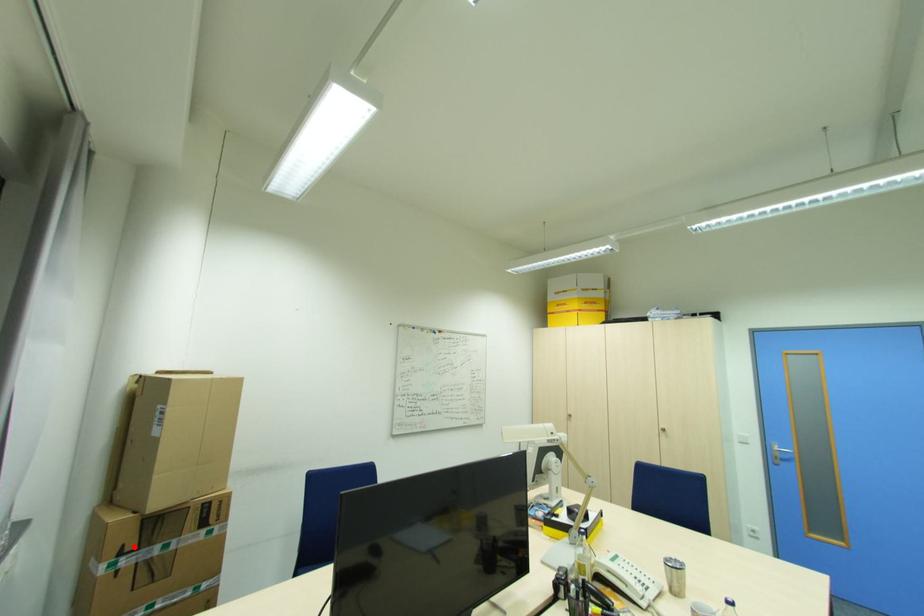
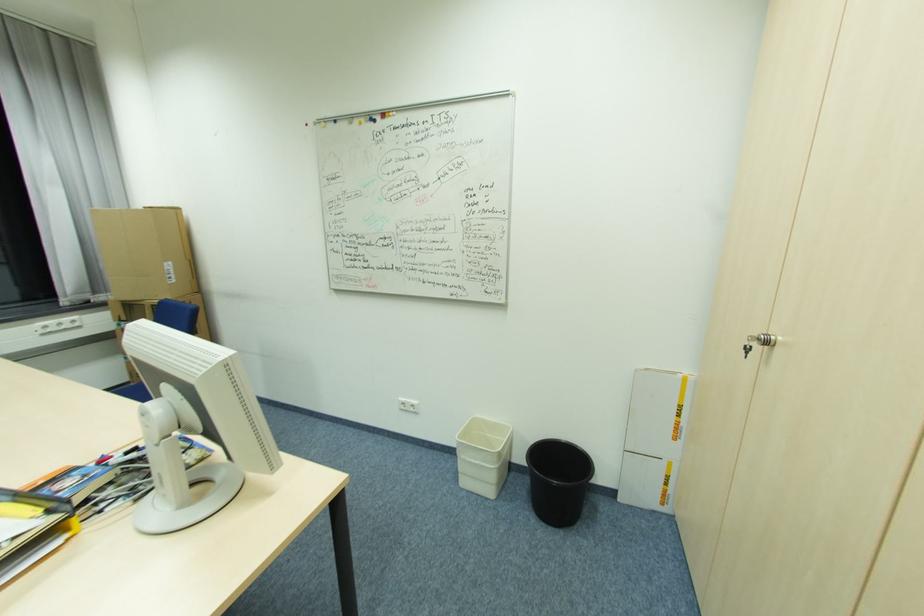
Question: A red point is marked in image1. In image2, is the corresponding 3D point closer to the camera or farther? Reply with the corresponding letter.

Choices:
 (A) The corresponding 3D point is closer.
 (B) The corresponding 3D point is farther.

Answer: (B)